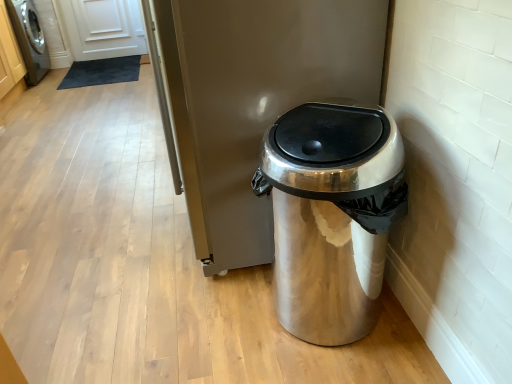
Question: From a real-world perspective, is satin silver trash can at center physically below brushed metal washing machine at left?

Choices:
 (A) no
 (B) yes

Answer: (A)

Question: Does satin silver trash can at center have a greater height compared to brushed metal washing machine at left?

Choices:
 (A) no
 (B) yes

Answer: (B)

Question: From the image's perspective, would you say satin silver trash can at center is positioned over brushed metal washing machine at left?

Choices:
 (A) yes
 (B) no

Answer: (B)

Question: Can you confirm if satin silver trash can at center is positioned to the right of brushed metal washing machine at left?

Choices:
 (A) no
 (B) yes

Answer: (B)

Question: Does satin silver trash can at center have a lesser height compared to brushed metal washing machine at left?

Choices:
 (A) yes
 (B) no

Answer: (B)

Question: Does satin silver trash can at center have a larger size compared to brushed metal washing machine at left?

Choices:
 (A) no
 (B) yes

Answer: (B)

Question: Would you consider brushed metal washing machine at left to be distant from shiny metallic trash can at lower right?

Choices:
 (A) yes
 (B) no

Answer: (A)

Question: Is brushed metal washing machine at left outside shiny metallic trash can at lower right?

Choices:
 (A) yes
 (B) no

Answer: (A)

Question: Can you confirm if brushed metal washing machine at left is thinner than shiny metallic trash can at lower right?

Choices:
 (A) no
 (B) yes

Answer: (B)

Question: Is brushed metal washing machine at left placed right next to shiny metallic trash can at lower right?

Choices:
 (A) no
 (B) yes

Answer: (A)

Question: Does brushed metal washing machine at left have a greater width compared to shiny metallic trash can at lower right?

Choices:
 (A) no
 (B) yes

Answer: (A)

Question: Is shiny metallic trash can at lower right inside brushed metal washing machine at left?

Choices:
 (A) yes
 (B) no

Answer: (B)

Question: Can you confirm if satin silver trash can at center is bigger than shiny metallic trash can at lower right?

Choices:
 (A) no
 (B) yes

Answer: (B)